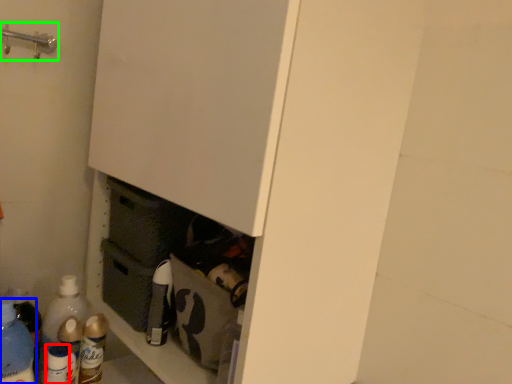
Question: Which object is positioned closest to bottle (highlighted by a red box)? Select from bottle (highlighted by a blue box) and door handle (highlighted by a green box).

Choices:
 (A) bottle
 (B) door handle

Answer: (A)